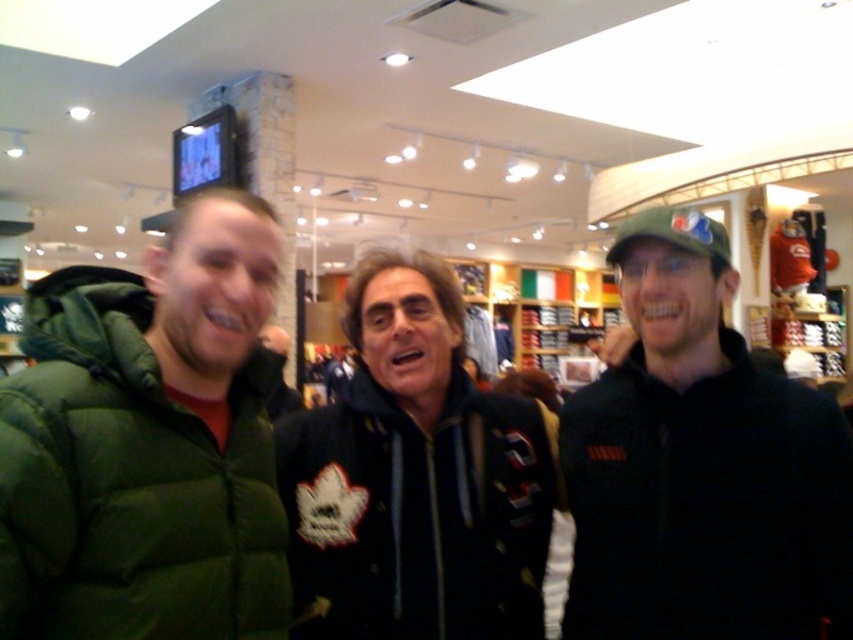
Which is above, black matte jacket at right or green puffy jacket at left?

green puffy jacket at left is higher up.

Is black matte jacket at right above green puffy jacket at left?

Actually, black matte jacket at right is below green puffy jacket at left.

Which is in front, point (844, 536) or point (117, 440)?

Point (117, 440) is more forward.

Locate an element on the screen. The height and width of the screenshot is (640, 853). black matte jacket at right is located at coordinates (700, 465).

Can you confirm if green puffy jacket at left is smaller than black fleece jacket at center?

No.

Is green puffy jacket at left to the right of black fleece jacket at center from the viewer's perspective?

No, green puffy jacket at left is not to the right of black fleece jacket at center.

Is point (142, 387) positioned in front of point (310, 509)?

That is True.

Find the location of a particular element. The height and width of the screenshot is (640, 853). green puffy jacket at left is located at coordinates tap(131, 483).

Can you confirm if black matte jacket at right is thinner than black fleece jacket at center?

Yes, black matte jacket at right is thinner than black fleece jacket at center.

Measure the distance between point (753, 442) and camera.

Point (753, 442) is 3.91 feet from camera.

I want to click on black matte jacket at right, so click(x=700, y=465).